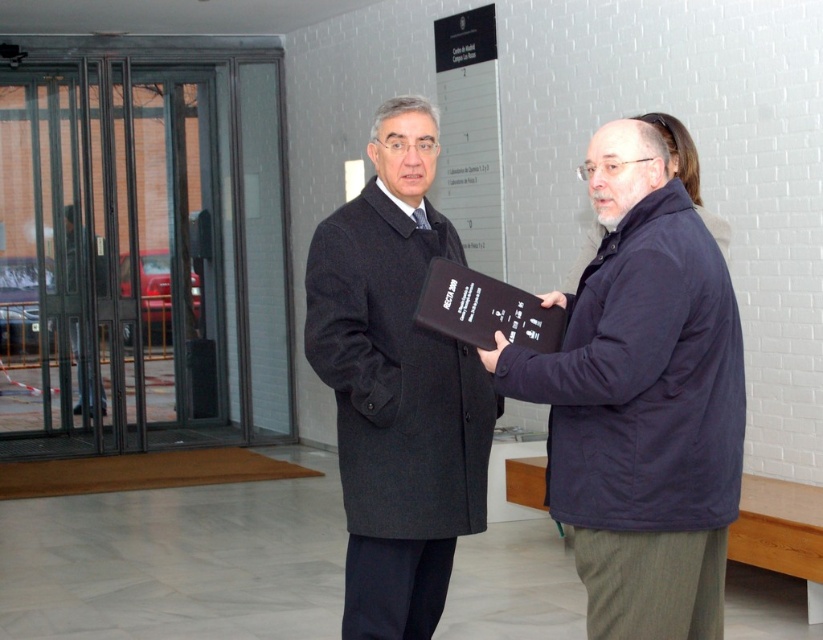
Which is below, black matte book at center or dark gray wool coat at center?

black matte book at center is below.

Who is more distant from viewer, (x=575, y=372) or (x=389, y=262)?

The point (x=389, y=262) is behind.

Where is `black matte book at center`? Image resolution: width=823 pixels, height=640 pixels. black matte book at center is located at coordinates (642, 396).